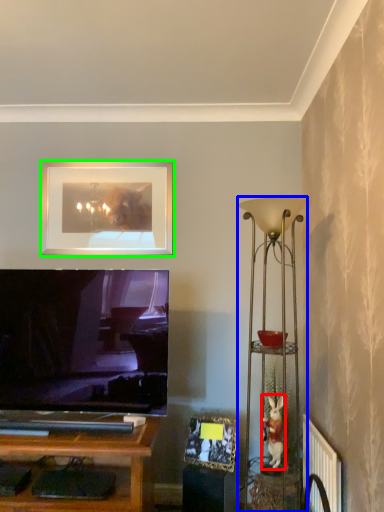
Question: Which is nearer to the toy (highlighted by a red box)? lamp (highlighted by a blue box) or picture frame (highlighted by a green box).

Choices:
 (A) lamp
 (B) picture frame

Answer: (A)